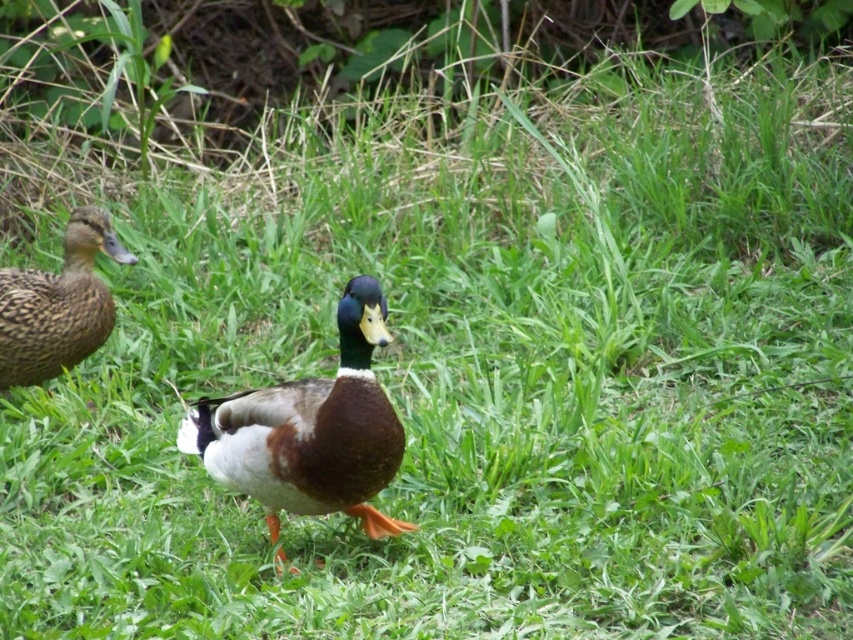
Question: Which object is closer to the camera taking this photo?

Choices:
 (A) shiny brown duck at center
 (B) brown speckled feathers at left

Answer: (A)

Question: Is shiny brown duck at center above brown speckled feathers at left?

Choices:
 (A) no
 (B) yes

Answer: (A)

Question: Among these points, which one is farthest from the camera?

Choices:
 (A) (383, 413)
 (B) (77, 273)

Answer: (B)

Question: Does shiny brown duck at center appear over brown speckled feathers at left?

Choices:
 (A) yes
 (B) no

Answer: (B)

Question: Which point is closer to the camera?

Choices:
 (A) brown speckled feathers at left
 (B) shiny brown duck at center

Answer: (B)

Question: Does shiny brown duck at center appear over brown speckled feathers at left?

Choices:
 (A) no
 (B) yes

Answer: (A)